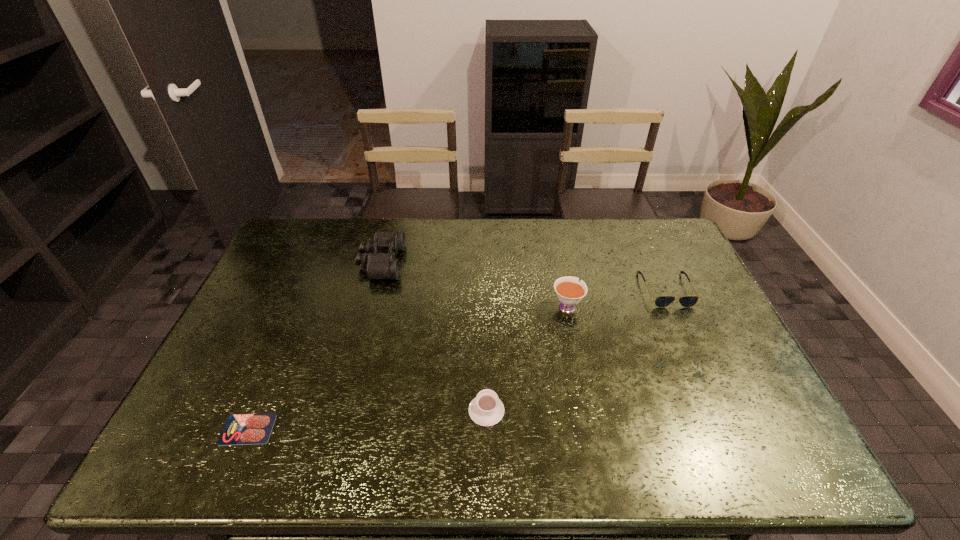
Identify the location of free area in between the left teacup and the leftmost object. This screenshot has width=960, height=540. (367, 420).

At what (x,y) coordinates should I click in order to perform the action: click on vacant area between the third object from right to left and the binoculars. Please return your answer as a coordinate pair (x, y). Looking at the image, I should click on (434, 336).

Identify the location of vacant area that lies between the nearer teacup and the farther teacup. (527, 358).

The width and height of the screenshot is (960, 540). Find the location of `vacant space that's between the binoculars and the farther teacup`. vacant space that's between the binoculars and the farther teacup is located at coordinates (474, 284).

The image size is (960, 540). I want to click on free space between the second object from right to left and the second object from left to right, so click(x=474, y=284).

Where is `free spot between the binoculars and the salami`? free spot between the binoculars and the salami is located at coordinates (315, 346).

Identify the location of vacant area that lies between the third object from left to right and the right teacup. (527, 358).

Locate which object is the closest to the fourth object from right to left. Please provide its 2D coordinates. Your answer should be formatted as a tuple, i.e. [(x, y)], where the tuple contains the x and y coordinates of a point satisfying the conditions above.

[(241, 429)]

Locate which object ranks third in proximity to the fourth object from right to left. Please provide its 2D coordinates. Your answer should be formatted as a tuple, i.e. [(x, y)], where the tuple contains the x and y coordinates of a point satisfying the conditions above.

[(569, 291)]

Locate an element on the screen. vacant area that satisfies the following two spatial constraints: 1. on the side of the farther teacup with the handle; 2. at the eyepieces of the binoculars is located at coordinates (558, 262).